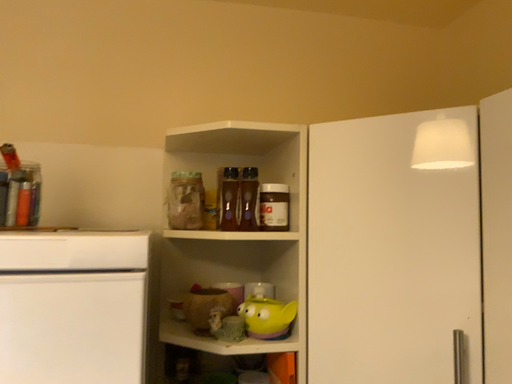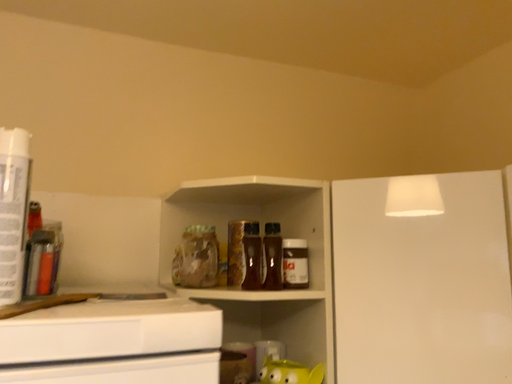
Question: How did the camera likely rotate when shooting the video?

Choices:
 (A) rotated right
 (B) rotated left

Answer: (A)